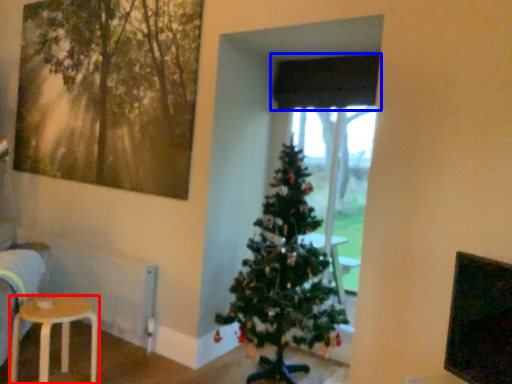
Question: Which of the following is the farthest to the observer, stool (highlighted by a red box) or curtain (highlighted by a blue box)?

Choices:
 (A) stool
 (B) curtain

Answer: (B)